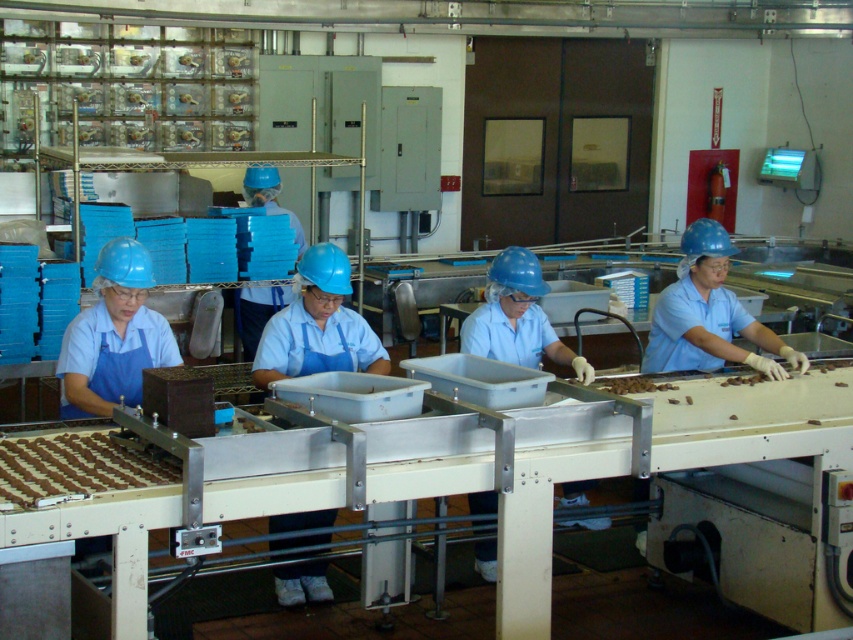
Does matte blue hard hat at left come in front of blue fabric gloves at center?

Yes, it is.

Can you confirm if matte blue hard hat at left is taller than blue fabric gloves at center?

Yes.

At what (x,y) coordinates should I click in order to perform the action: click on matte blue hard hat at left. Please return your answer as a coordinate pair (x, y). The image size is (853, 640). Looking at the image, I should click on (113, 336).

Where is `matte blue hard hat at left`? Image resolution: width=853 pixels, height=640 pixels. matte blue hard hat at left is located at coordinates (113, 336).

Can you confirm if blue matte helmet at right is positioned to the left of brown matte chocolate at center?

In fact, blue matte helmet at right is to the right of brown matte chocolate at center.

Who is higher up, blue matte helmet at right or brown matte chocolate at center?

blue matte helmet at right

Is point (700, 362) positioned after point (630, 385)?

Yes, point (700, 362) is behind point (630, 385).

The width and height of the screenshot is (853, 640). Identify the location of blue matte helmet at right. (708, 314).

Can you confirm if light blue fabric at center is positioned above blue fabric gloves at center?

Incorrect, light blue fabric at center is not positioned above blue fabric gloves at center.

Which is more to the left, light blue fabric at center or blue fabric gloves at center?

blue fabric gloves at center

Where is `light blue fabric at center`? light blue fabric at center is located at coordinates (517, 317).

What are the coordinates of `light blue fabric at center` in the screenshot? It's located at (517, 317).